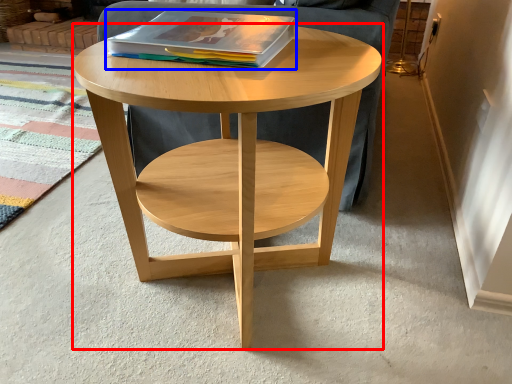
Question: Which point is further to the camera, coffee table (highlighted by a red box) or magazine (highlighted by a blue box)?

Choices:
 (A) coffee table
 (B) magazine

Answer: (B)